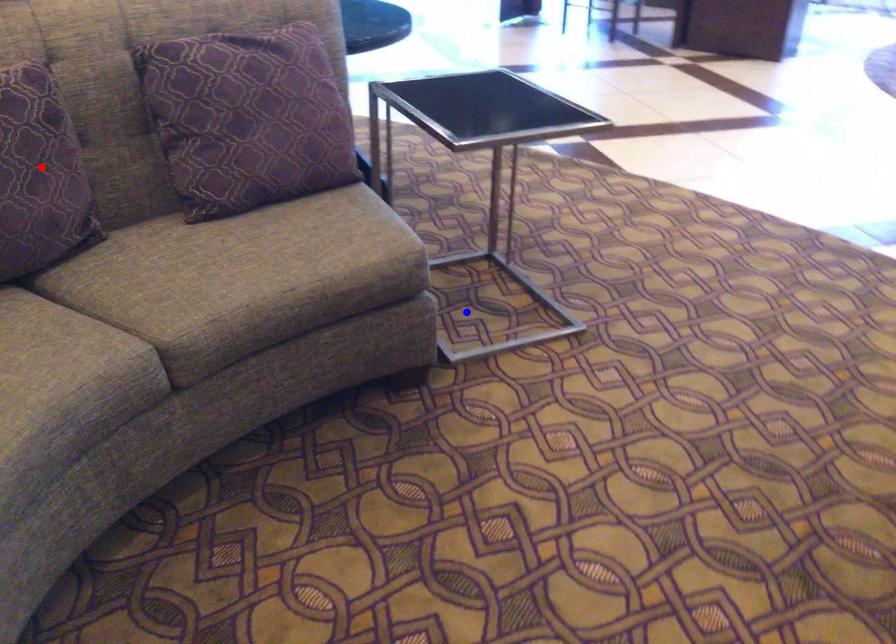
Question: In the image, two points are highlighted. Which point is nearer to the camera? Reply with the corresponding letter.

Choices:
 (A) blue point
 (B) red point

Answer: (B)